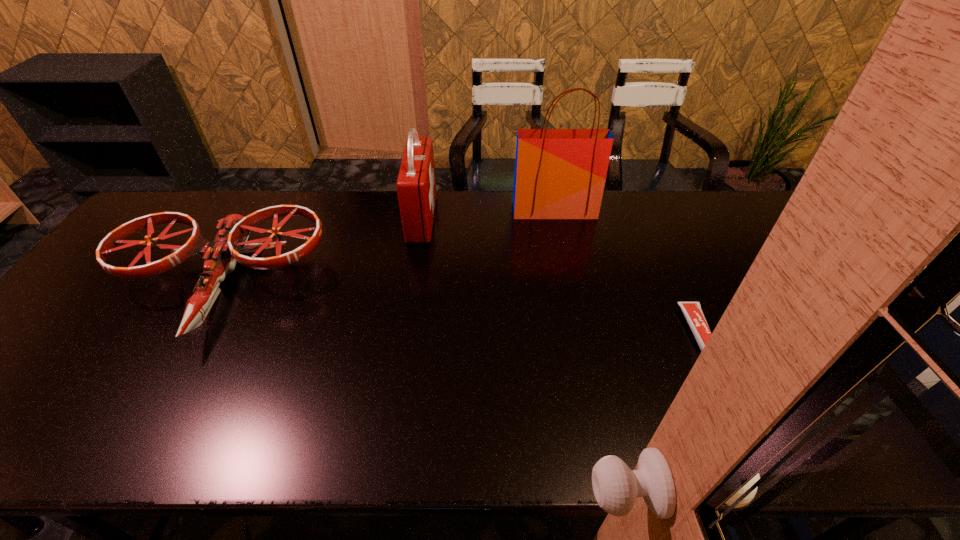
Locate an element on the screen. The image size is (960, 540). free space between the drone and the third shortest object is located at coordinates (321, 253).

Identify which object is the third nearest to the tallest object. Please provide its 2D coordinates. Your answer should be formatted as a tuple, i.e. [(x, y)], where the tuple contains the x and y coordinates of a point satisfying the conditions above.

[(220, 257)]

You are a GUI agent. You are given a task and a screenshot of the screen. Output one action in this format:
    pyautogui.click(x=<x>, y=<y>)
    Task: Click on the object that is the third closest to the toothpaste
    The height and width of the screenshot is (540, 960).
    Given the screenshot: What is the action you would take?
    pyautogui.click(x=220, y=257)

Find the location of `free space that satisfies the following two spatial constraints: 1. on the handle side of the third object from left to right; 2. on the front face of the second tallest object`. free space that satisfies the following two spatial constraints: 1. on the handle side of the third object from left to right; 2. on the front face of the second tallest object is located at coordinates (556, 218).

You are a GUI agent. You are given a task and a screenshot of the screen. Output one action in this format:
    pyautogui.click(x=<x>, y=<y>)
    Task: Click on the vacant area in the image that satisfies the following two spatial constraints: 1. on the handle side of the second object from right to left; 2. on the front face of the third shortest object
    
    Given the screenshot: What is the action you would take?
    pyautogui.click(x=556, y=218)

You are a GUI agent. You are given a task and a screenshot of the screen. Output one action in this format:
    pyautogui.click(x=<x>, y=<y>)
    Task: Click on the free region that satisfies the following two spatial constraints: 1. on the handle side of the tallest object; 2. on the front face of the first-aid kit
    The image size is (960, 540).
    Given the screenshot: What is the action you would take?
    pyautogui.click(x=556, y=218)

This screenshot has height=540, width=960. Find the location of `vacant region that satisfies the following two spatial constraints: 1. on the handle side of the shopping bag; 2. on the front face of the second object from left to right`. vacant region that satisfies the following two spatial constraints: 1. on the handle side of the shopping bag; 2. on the front face of the second object from left to right is located at coordinates (556, 218).

I want to click on vacant region that satisfies the following two spatial constraints: 1. on the handle side of the shopping bag; 2. on the front face of the third object from right to left, so click(556, 218).

Locate an element on the screen. The image size is (960, 540). vacant space that satisfies the following two spatial constraints: 1. on the handle side of the third object from left to right; 2. on the front face of the second tallest object is located at coordinates (556, 218).